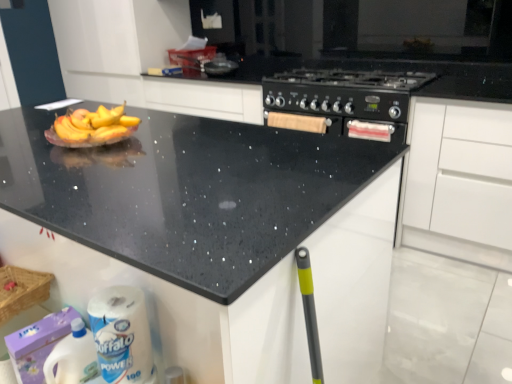
Question: Looking at their shapes, would you say white paper towel at lower left is wider or thinner than black matte stove at center?

Choices:
 (A) wide
 (B) thin

Answer: (B)

Question: From a real-world perspective, is white paper towel at lower left above or below black matte stove at center?

Choices:
 (A) above
 (B) below

Answer: (B)

Question: Which of these objects is positioned closest to the white paper towel at lower left?

Choices:
 (A) white plastic bottle at lower left
 (B) black speckled granite at upper center
 (C) white matte cabinet at lower right
 (D) black matte stove at center

Answer: (A)

Question: Estimate the real-world distances between objects in this image. Which object is farther from the white paper towel at lower left?

Choices:
 (A) white matte cabinet at lower right
 (B) black speckled granite at upper center
 (C) white plastic bottle at lower left
 (D) black matte stove at center

Answer: (A)